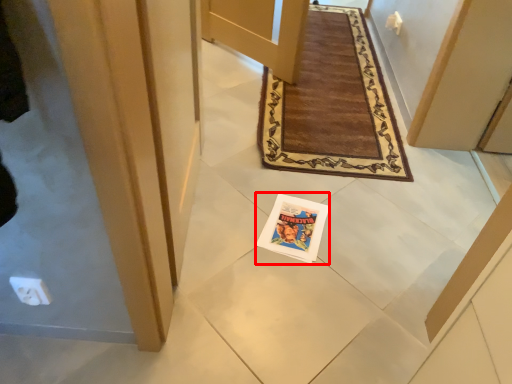
Question: From the image's perspective, where is magazine (annotated by the red box) located in relation to door in the image?

Choices:
 (A) below
 (B) above

Answer: (A)